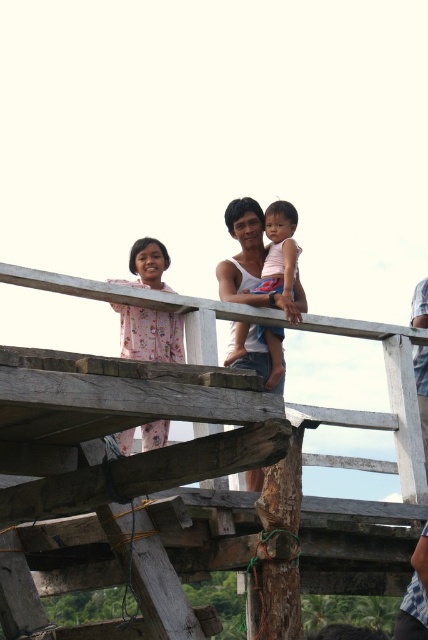
Can you confirm if pink fabric at center is thinner than pink floral dress at upper left?

No.

Describe the element at coordinates (252, 262) in the screenshot. I see `pink fabric at center` at that location.

Where is `pink fabric at center`? Image resolution: width=428 pixels, height=640 pixels. pink fabric at center is located at coordinates point(252,262).

Is point (26, 353) positioned after point (133, 243)?

No, (26, 353) is closer to viewer.

Can you confirm if wooden at upper center is bigger than pink floral dress at upper left?

Yes.

Measure the distance between point (x=406, y=348) and camera.

The distance of point (x=406, y=348) from camera is 34.41 meters.

Identify the location of wooden at upper center. (177, 474).

Is point (392, 412) closer to camera compared to point (229, 220)?

Yes, point (392, 412) is in front of point (229, 220).

The height and width of the screenshot is (640, 428). I want to click on wooden at upper center, so click(x=177, y=474).

Identify the location of wooden at upper center. The width and height of the screenshot is (428, 640). (177, 474).